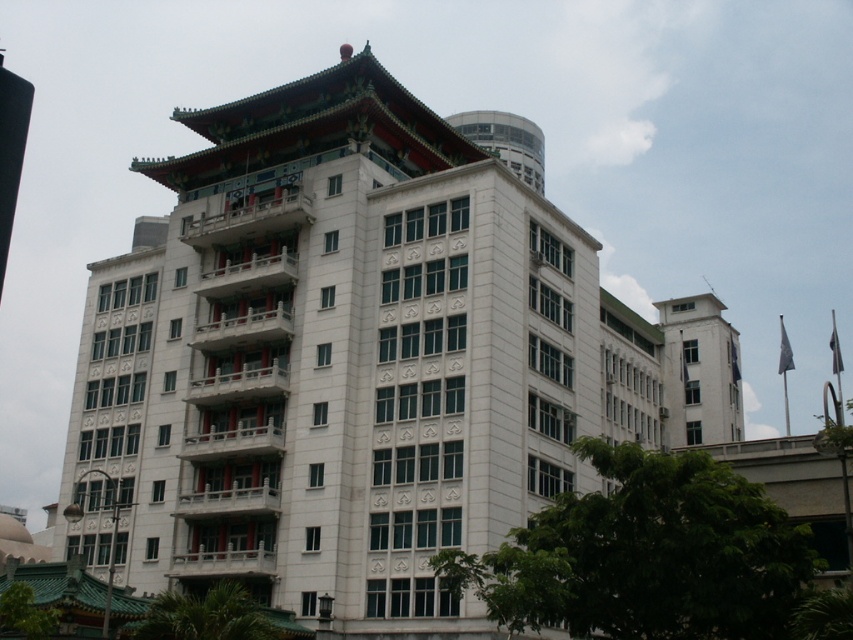
Can you confirm if white stone building at center is shorter than white smooth building at upper right?

No, white stone building at center is not shorter than white smooth building at upper right.

Between point (509, 528) and point (740, 378), which one is positioned behind?

The point (740, 378) is behind.

Does point (242, 467) lie in front of point (717, 404)?

Yes, point (242, 467) is closer to viewer.

The width and height of the screenshot is (853, 640). In order to click on white stone building at center in this screenshot , I will do click(341, 356).